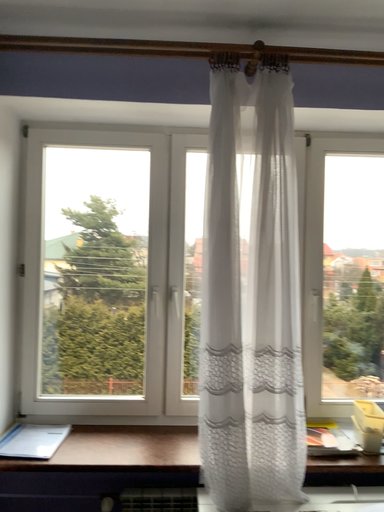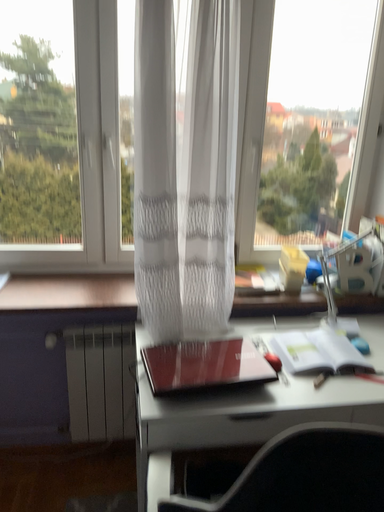
Question: How did the camera likely rotate when shooting the video?

Choices:
 (A) rotated left
 (B) rotated right

Answer: (B)